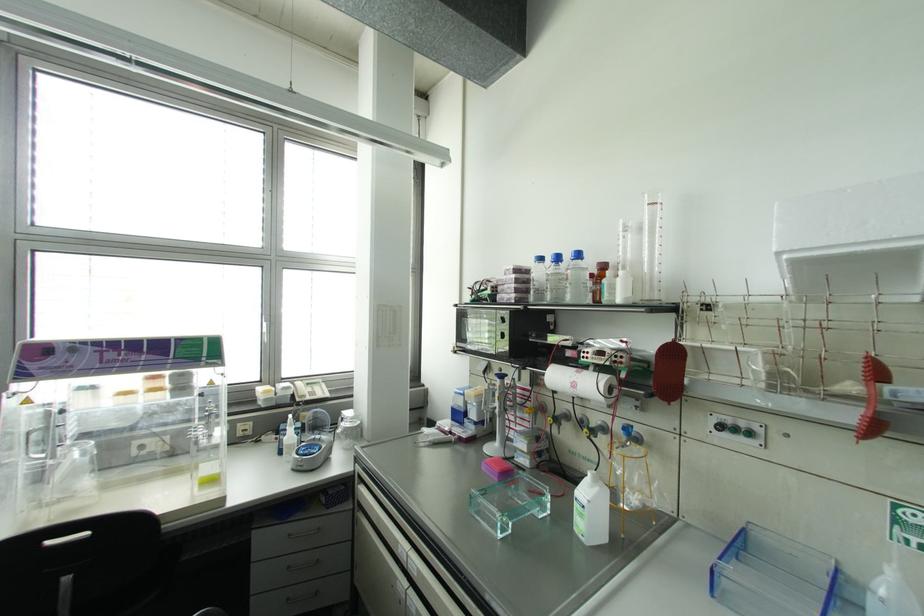
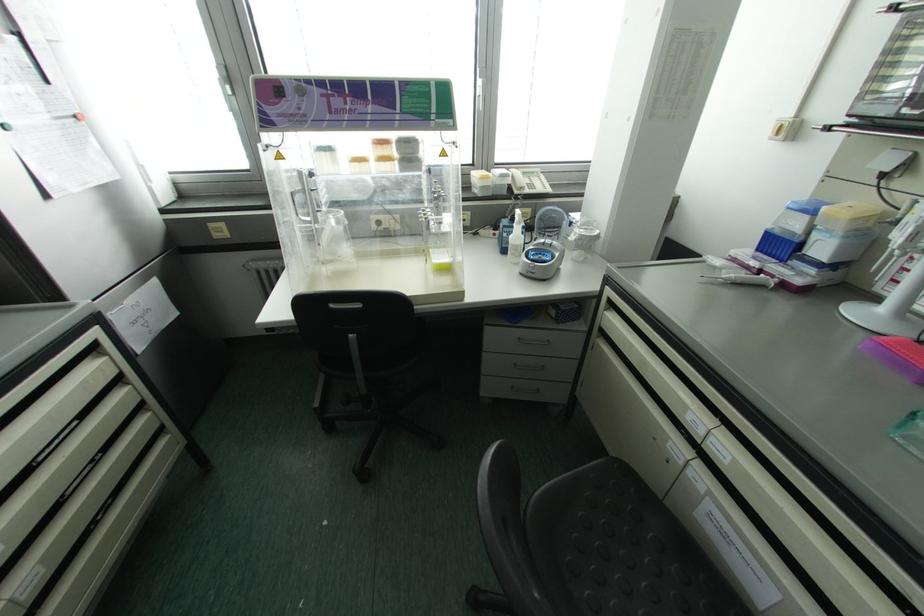
The point at (289,535) is marked in the first image. Where is the corresponding point in the second image?

(518, 339)